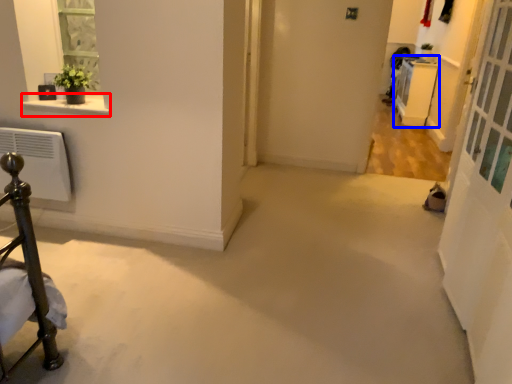
Question: Which point is closer to the camera, window sill (highlighted by a red box) or furniture (highlighted by a blue box)?

Choices:
 (A) window sill
 (B) furniture

Answer: (A)